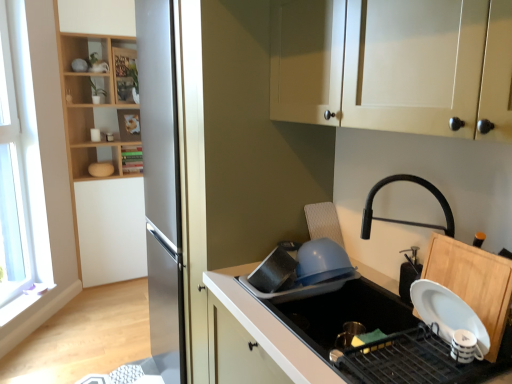
Question: Is transparent glass window at left inside or outside of green matte bookshelf at upper left, the 1th shelf ordered from the bottom?

Choices:
 (A) outside
 (B) inside

Answer: (A)

Question: In terms of width, does transparent glass window at left look wider or thinner when compared to green matte bookshelf at upper left, the 1th shelf ordered from the bottom?

Choices:
 (A) thin
 (B) wide

Answer: (A)

Question: Which object is the closest to the green matte bookshelf at upper left, the 1th shelf ordered from the bottom?

Choices:
 (A) light wood/wooden shelves at upper left, the third shelf when ordered from bottom to top
 (B) wooden bookshelf at upper left, which ranks as the 2th shelf in top-to-bottom order
 (C) matte blue bowl at center, the 1th appliance positioned from the left
 (D) transparent glass window at left
 (E) white matte cabinet at upper center

Answer: (B)

Question: Considering the real-world distances, which object is closest to the black matte soap dispenser at right, the 1th appliance positioned from the right?

Choices:
 (A) wooden bookshelf at upper left, the 2th shelf from the bottom
 (B) white matte countertop at lower right
 (C) green matte bookshelf at upper left, which appears as the third shelf when viewed from the top
 (D) light wood/wooden shelves at upper left, which is the first shelf in top-to-bottom order
 (E) transparent glass window at left

Answer: (B)